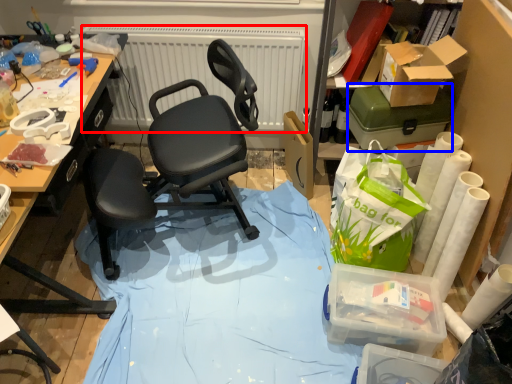
Question: Which object appears farthest to the camera in this image, radiator (highlighted by a red box) or box (highlighted by a blue box)?

Choices:
 (A) radiator
 (B) box

Answer: (A)